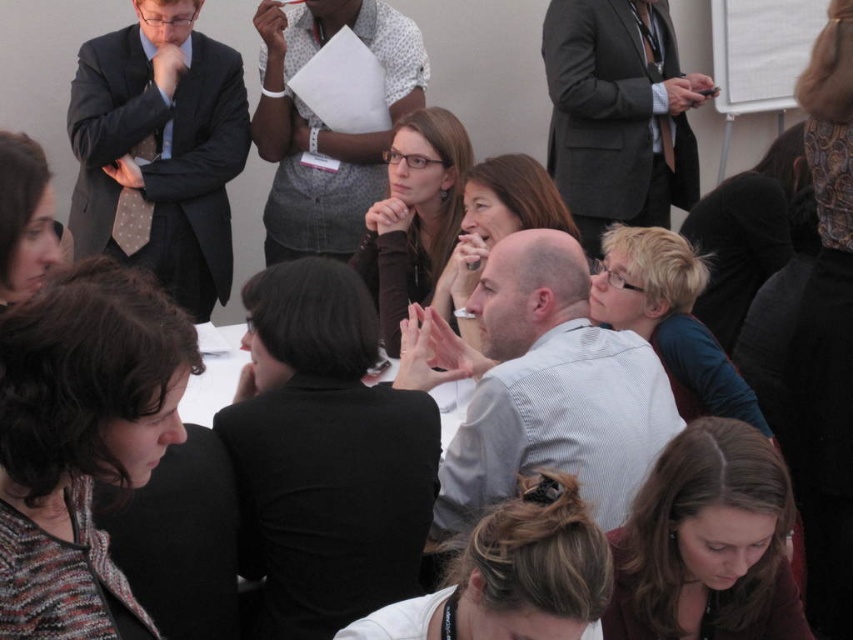
Question: Is matte black shirt at center smaller than matte gray shirt at center?

Choices:
 (A) yes
 (B) no

Answer: (A)

Question: Where is smooth brown hair at lower center located in relation to blonde hair at center in the image?

Choices:
 (A) below
 (B) above

Answer: (A)

Question: Which point is closer to the camera taking this photo?

Choices:
 (A) (477, 224)
 (B) (35, 282)
 (C) (619, 273)

Answer: (B)

Question: Which point is farther to the camera?

Choices:
 (A) (15, 376)
 (B) (35, 145)
 (C) (465, 248)

Answer: (C)

Question: Among these points, which one is nearest to the camera?

Choices:
 (A) (18, 243)
 (B) (50, 380)
 (C) (477, 620)

Answer: (B)

Question: Can you confirm if multicolored knitted sweater at lower left is positioned above blonde hair at center?

Choices:
 (A) no
 (B) yes

Answer: (A)